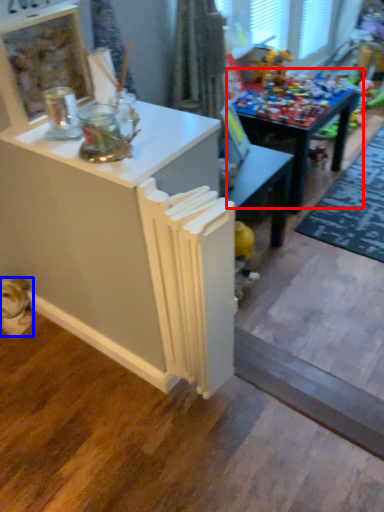
Question: Which of the following is the closest to the observer, table (highlighted by a red box) or animal (highlighted by a blue box)?

Choices:
 (A) table
 (B) animal

Answer: (B)